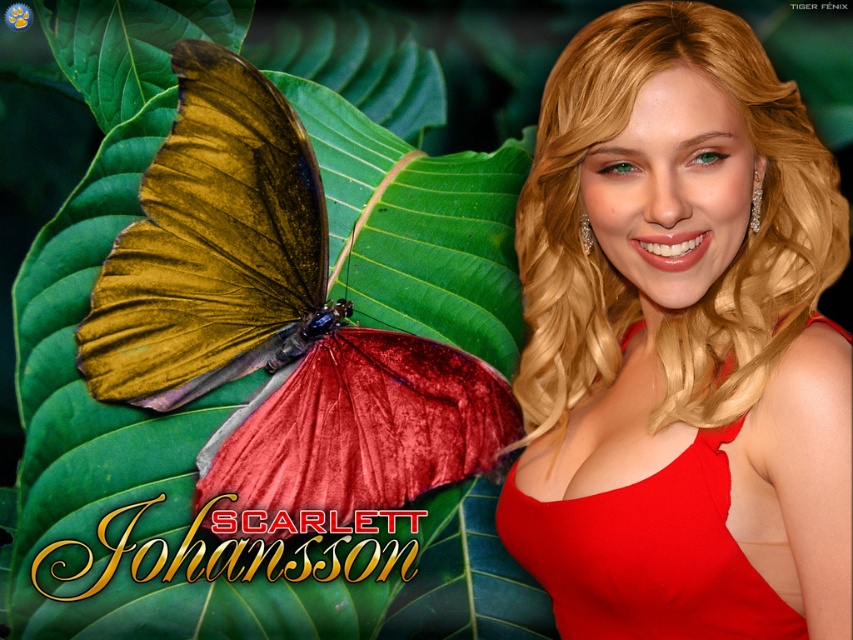
Between shiny metallic butterfly at center-left and matte red dress at right, which one is positioned lower?

matte red dress at right is lower down.

Where is `shiny metallic butterfly at center-left`? shiny metallic butterfly at center-left is located at coordinates (273, 326).

Describe the element at coordinates (273, 326) in the screenshot. I see `shiny metallic butterfly at center-left` at that location.

The image size is (853, 640). In order to click on shiny metallic butterfly at center-left in this screenshot , I will do `click(273, 326)`.